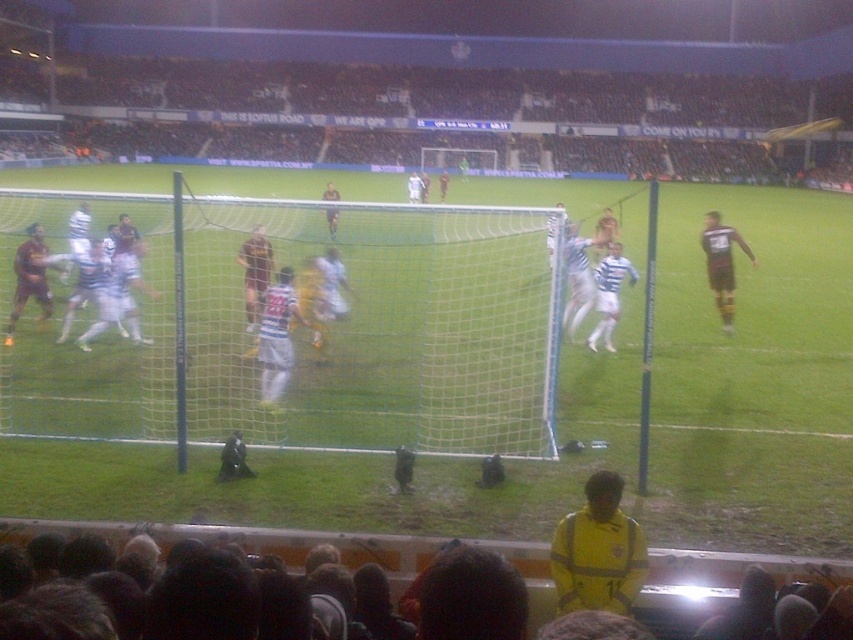
Where is `striped jersey at center`? The image size is (853, 640). striped jersey at center is located at coordinates (277, 337).

Locate an element on the screen. The width and height of the screenshot is (853, 640). striped jersey at center is located at coordinates (277, 337).

Where is `striped jersey at center`? striped jersey at center is located at coordinates (277, 337).

Which of these two, yellow jersey at lower center or brown jersey at right, stands taller?

brown jersey at right

What do you see at coordinates (598, 552) in the screenshot? I see `yellow jersey at lower center` at bounding box center [598, 552].

At what (x,y) coordinates should I click in order to perform the action: click on yellow jersey at lower center. Please return your answer as a coordinate pair (x, y). This screenshot has width=853, height=640. Looking at the image, I should click on (598, 552).

Can you confirm if white matte jersey at center is positioned above yellow jersey at center?

Incorrect, white matte jersey at center is not positioned above yellow jersey at center.

Can you confirm if white matte jersey at center is taller than yellow jersey at center?

In fact, white matte jersey at center may be shorter than yellow jersey at center.

Where is `white matte jersey at center`? Image resolution: width=853 pixels, height=640 pixels. white matte jersey at center is located at coordinates (608, 292).

Identify the location of white matte jersey at center. The height and width of the screenshot is (640, 853). (608, 292).